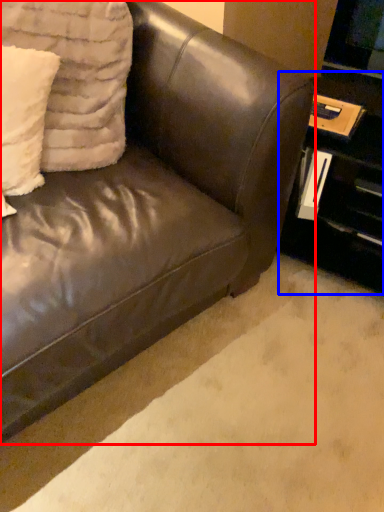
Question: Which of the following is the farthest to the observer, studio couch (highlighted by a red box) or table (highlighted by a blue box)?

Choices:
 (A) studio couch
 (B) table

Answer: (B)